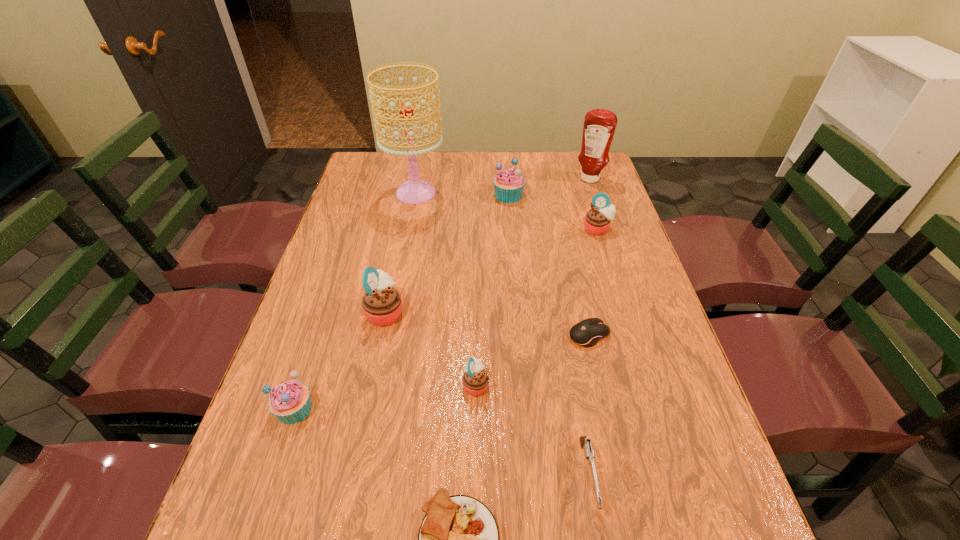
This screenshot has height=540, width=960. What are the coordinates of `free space located on the front of the farthest muffin` in the screenshot? It's located at (511, 227).

This screenshot has width=960, height=540. I want to click on free space located 0.170m on the front-facing side of the fourth farthest object, so click(x=612, y=276).

This screenshot has height=540, width=960. In order to click on vacant region located 0.050m on the front-facing side of the nearest pink muffin in this screenshot , I will do `click(512, 384)`.

You are a GUI agent. You are given a task and a screenshot of the screen. Output one action in this format:
    pyautogui.click(x=<x>, y=<y>)
    Task: Click on the vacant space located 0.300m on the right of the nearer blue muffin
    The image size is (960, 540).
    Given the screenshot: What is the action you would take?
    457,409

The image size is (960, 540). Find the location of `vacant area situated on the left of the eighth object from left to right`. vacant area situated on the left of the eighth object from left to right is located at coordinates 498,335.

The image size is (960, 540). I want to click on lampshade that is at the far edge, so click(x=415, y=191).

Find the location of `condiment located in the far edge section of the desktop`. condiment located in the far edge section of the desktop is located at coordinates (599, 126).

What are the coordinates of `lampshade that is at the left edge` in the screenshot? It's located at (415, 191).

I want to click on condiment that is at the right edge, so click(599, 126).

At what (x,y) coordinates should I click in order to perform the action: click on muffin that is at the right edge. Please return your answer as a coordinate pair (x, y). The height and width of the screenshot is (540, 960). Looking at the image, I should click on (597, 221).